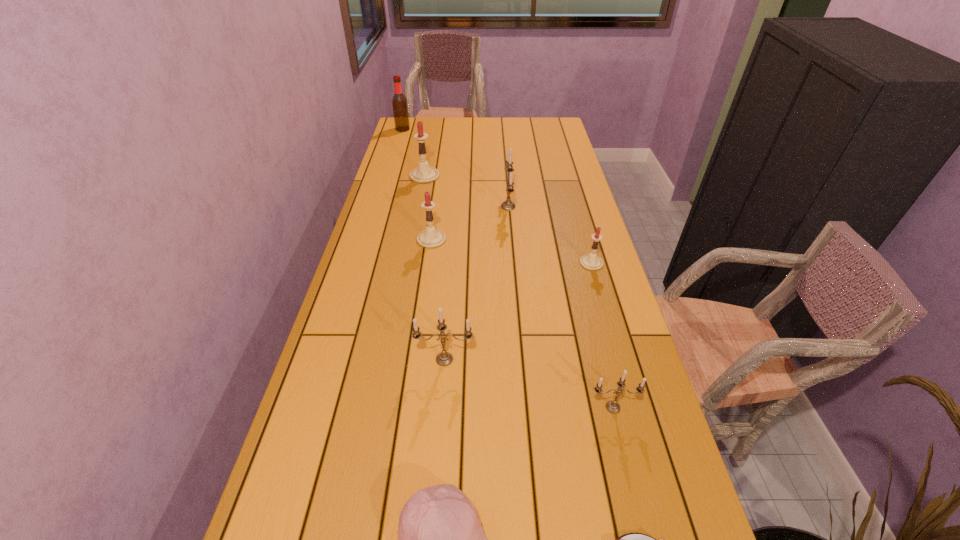
I want to click on vacant space located 0.350m on the back of the third nearest object, so click(585, 294).

Identify the location of object at the far edge. (399, 102).

The width and height of the screenshot is (960, 540). Identify the location of beer bottle present at the left edge. (399, 102).

Find the location of a particular element. Image resolution: width=960 pixels, height=540 pixels. candle that is at the left edge is located at coordinates (423, 174).

In order to click on object that is positioned at the far left corner in this screenshot , I will do pyautogui.click(x=399, y=102).

Where is `vacant space at the far edge of the desktop`? vacant space at the far edge of the desktop is located at coordinates (502, 117).

You are a GUI agent. You are given a task and a screenshot of the screen. Output one action in this format:
    pyautogui.click(x=<x>, y=<y>)
    Task: Click on the vacant space at the left edge of the desktop
    
    Given the screenshot: What is the action you would take?
    pos(411,151)

The width and height of the screenshot is (960, 540). What are the coordinates of `free region at the right edge` in the screenshot? It's located at (559, 166).

You are a GUI agent. You are given a task and a screenshot of the screen. Output one action in this format:
    pyautogui.click(x=<x>, y=<y>)
    Task: Click on the vacant area at the far left corner
    The height and width of the screenshot is (540, 960).
    Given the screenshot: What is the action you would take?
    pyautogui.click(x=399, y=135)

This screenshot has height=540, width=960. I want to click on vacant space at the far right corner of the desktop, so click(535, 123).